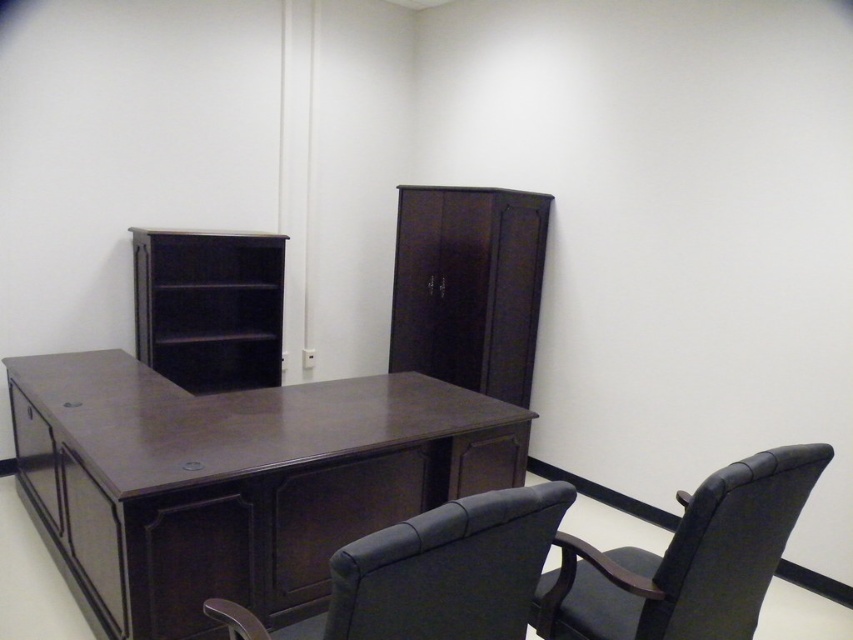
Does leather-like black chair at center have a greater height compared to dark wood bookshelf at upper left?

No, leather-like black chair at center is not taller than dark wood bookshelf at upper left.

What do you see at coordinates (448, 570) in the screenshot? The height and width of the screenshot is (640, 853). I see `leather-like black chair at center` at bounding box center [448, 570].

Between point (399, 612) and point (186, 304), which one is positioned behind?

Positioned behind is point (186, 304).

Identify the location of leather-like black chair at center. (448, 570).

From the picture: Can you confirm if black leather chair at lower right is positioned to the left of dark wood drawer at lower left?

Incorrect, black leather chair at lower right is not on the left side of dark wood drawer at lower left.

What do you see at coordinates (688, 560) in the screenshot? The width and height of the screenshot is (853, 640). I see `black leather chair at lower right` at bounding box center [688, 560].

Between point (691, 588) and point (28, 456), which one is positioned in front?

Point (691, 588) is more forward.

The width and height of the screenshot is (853, 640). What are the coordinates of `black leather chair at lower right` in the screenshot? It's located at (688, 560).

How far apart are dark wood bookshelf at upper left and dark wood drawer at lower left?

dark wood bookshelf at upper left and dark wood drawer at lower left are 97.02 centimeters apart from each other.

Consider the image. Who is higher up, dark wood bookshelf at upper left or dark wood drawer at lower left?

dark wood bookshelf at upper left is above.

Identify the location of dark wood bookshelf at upper left. (209, 307).